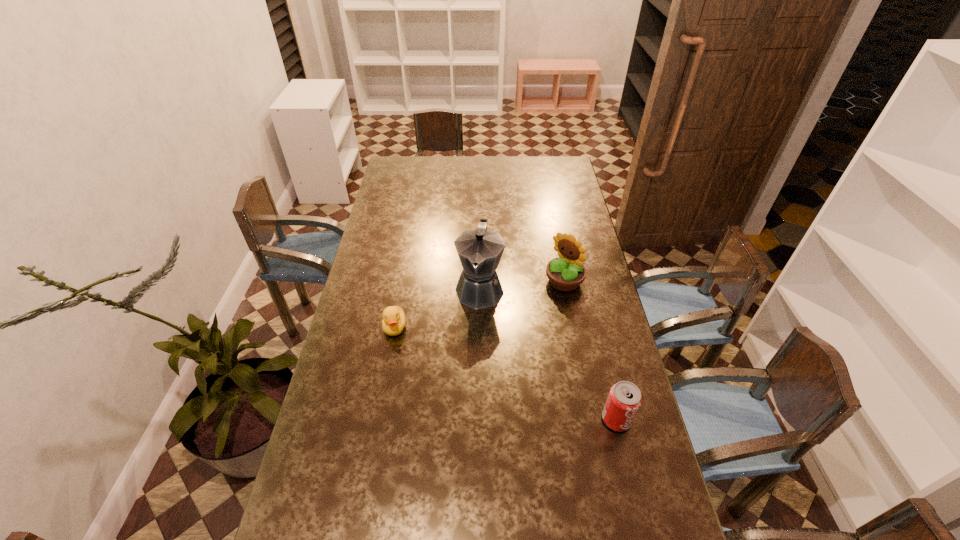
Identify the location of the shortest object. (394, 320).

At what (x,y) coordinates should I click in order to perform the action: click on the leftmost object. Please return your answer as a coordinate pair (x, y). Looking at the image, I should click on (394, 320).

Locate an element on the screen. This screenshot has width=960, height=540. the nearest object is located at coordinates (624, 400).

At what (x,y) coordinates should I click in order to perform the action: click on soda can. Please return your answer as a coordinate pair (x, y). This screenshot has height=540, width=960. Looking at the image, I should click on (624, 400).

Identify the location of the tallest object. Image resolution: width=960 pixels, height=540 pixels. (480, 250).

The image size is (960, 540). Identify the location of the second object from left to right. coord(480,250).

Locate an element on the screen. the third shortest object is located at coordinates (565, 273).

Locate an element on the screen. The width and height of the screenshot is (960, 540). vacant space located on the face of the leftmost object is located at coordinates (376, 431).

Where is `free location located 0.190m on the back of the soda can`? free location located 0.190m on the back of the soda can is located at coordinates (601, 353).

Where is `vacant region located at the spout of the tallest object`? vacant region located at the spout of the tallest object is located at coordinates (469, 359).